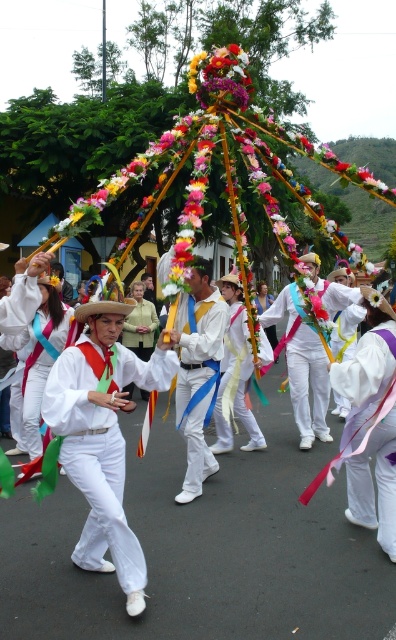
Question: Can you confirm if white satin outfit at center is positioned above white satin shirt at center?

Choices:
 (A) no
 (B) yes

Answer: (A)

Question: Which of the following is the closest to the observer?

Choices:
 (A) (289, 557)
 (B) (205, 314)

Answer: (A)

Question: Among these objects, which one is farthest from the camera?

Choices:
 (A) white satin outfit at center
 (B) white satin shirt at center

Answer: (B)

Question: Is white satin outfit at center behind white satin shirt at center?

Choices:
 (A) no
 (B) yes

Answer: (A)

Question: Can you confirm if white satin outfit at center is bigger than white satin shirt at center?

Choices:
 (A) yes
 (B) no

Answer: (A)